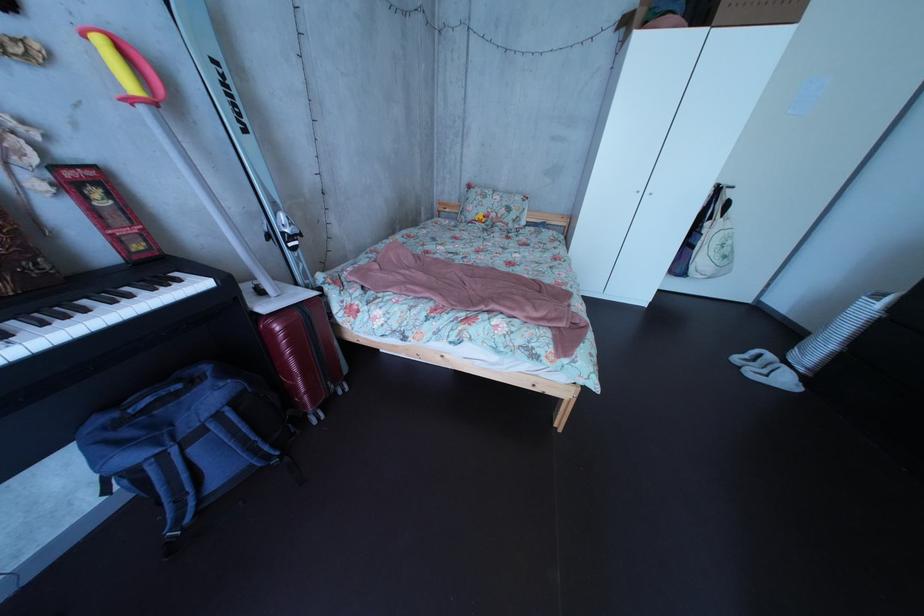
What are the coordinates of `piano keys` in the screenshot? It's located at (102, 309).